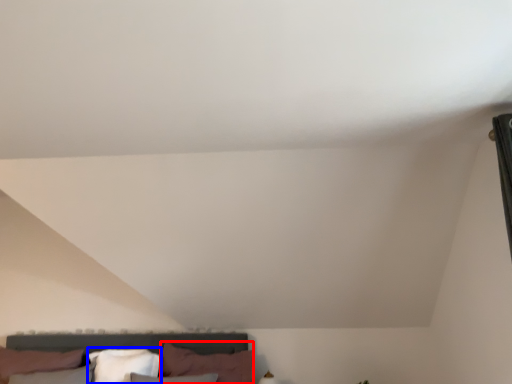
Question: Which object is further to the camera taking this photo, pillow (highlighted by a red box) or pillow (highlighted by a blue box)?

Choices:
 (A) pillow
 (B) pillow

Answer: (B)